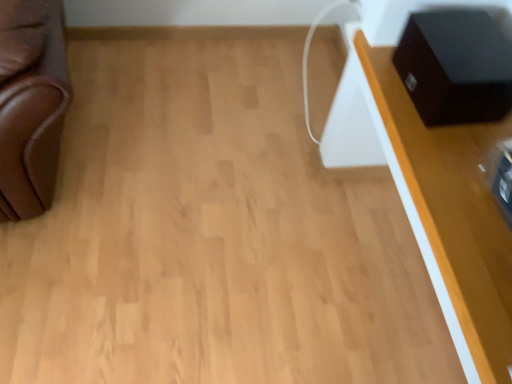
Where is `vacant space situated above black matte speaker at upper right (from a real-world perspective)`? vacant space situated above black matte speaker at upper right (from a real-world perspective) is located at coordinates 470,45.